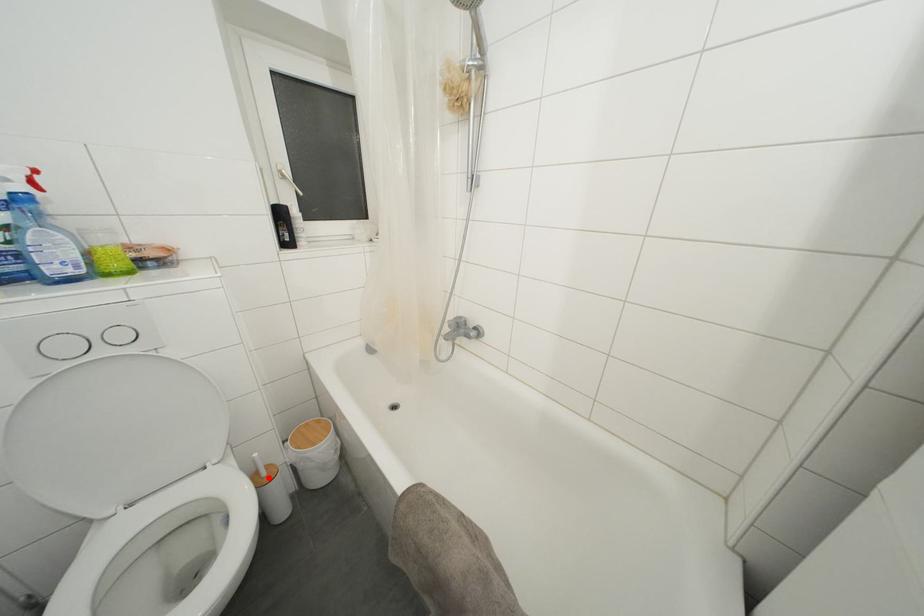
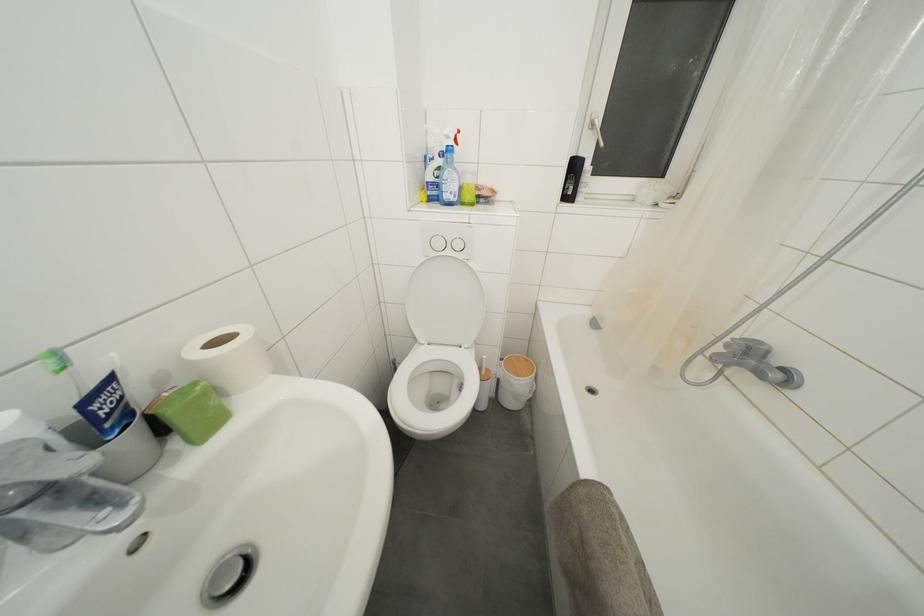
The point at the highlighted location is marked in the first image. Where is the corresponding point in the second image?

(488, 378)